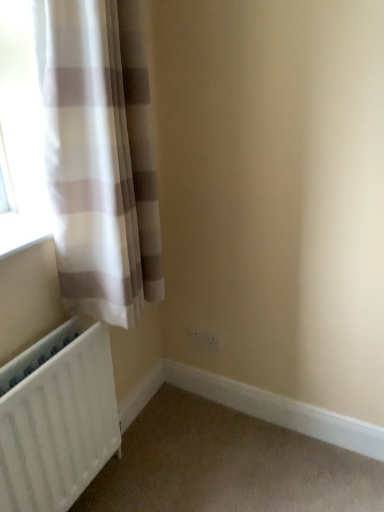
Question: Can you confirm if white sheer curtain at left is positioned to the left of white matte radiator at lower left?

Choices:
 (A) yes
 (B) no

Answer: (B)

Question: Is white sheer curtain at left positioned before white matte radiator at lower left?

Choices:
 (A) yes
 (B) no

Answer: (A)

Question: Does white sheer curtain at left have a greater height compared to white matte radiator at lower left?

Choices:
 (A) no
 (B) yes

Answer: (B)

Question: From a real-world perspective, is white sheer curtain at left physically above white matte radiator at lower left?

Choices:
 (A) yes
 (B) no

Answer: (A)

Question: Is white sheer curtain at left facing towards white matte radiator at lower left?

Choices:
 (A) yes
 (B) no

Answer: (B)

Question: From the image's perspective, is white sheer curtain at left located above white matte radiator at lower left?

Choices:
 (A) yes
 (B) no

Answer: (A)

Question: Can you confirm if white sheer curtain at left is taller than white plastic electric outlet at lower center?

Choices:
 (A) no
 (B) yes

Answer: (B)

Question: From a real-world perspective, is white sheer curtain at left under white plastic electric outlet at lower center?

Choices:
 (A) no
 (B) yes

Answer: (A)

Question: Considering the relative positions of white sheer curtain at left and white plastic electric outlet at lower center in the image provided, is white sheer curtain at left to the right of white plastic electric outlet at lower center from the viewer's perspective?

Choices:
 (A) yes
 (B) no

Answer: (B)

Question: Is the depth of white sheer curtain at left less than that of white plastic electric outlet at lower center?

Choices:
 (A) yes
 (B) no

Answer: (A)

Question: Is white sheer curtain at left behind white plastic electric outlet at lower center?

Choices:
 (A) yes
 (B) no

Answer: (B)

Question: Could white plastic electric outlet at lower center be considered to be inside white sheer curtain at left?

Choices:
 (A) no
 (B) yes

Answer: (A)

Question: Does white matte radiator at lower left appear on the right side of white plastic electric outlet at lower center?

Choices:
 (A) no
 (B) yes

Answer: (A)